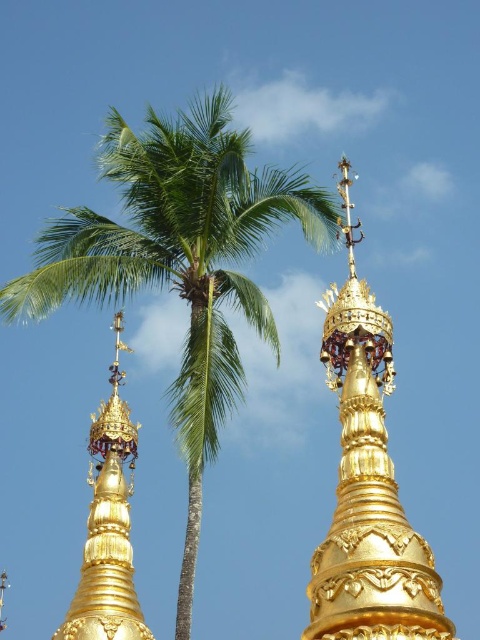
Question: Is green leafy palm tree at left smaller than gold polished stupa at upper center?

Choices:
 (A) no
 (B) yes

Answer: (A)

Question: Among these objects, which one is farthest from the camera?

Choices:
 (A) gold polished stupa at upper center
 (B) gold/gilded stupa at center
 (C) green leafy palm tree at left

Answer: (B)

Question: Which of the following is the closest to the observer?

Choices:
 (A) green leafy palm tree at left
 (B) gold polished stupa at upper center
 (C) gold/gilded stupa at center

Answer: (B)

Question: Observing the image, what is the correct spatial positioning of green leafy palm tree at left in reference to gold/gilded stupa at center?

Choices:
 (A) above
 (B) below

Answer: (A)

Question: Is gold polished stupa at upper center further to the viewer compared to gold/gilded stupa at center?

Choices:
 (A) no
 (B) yes

Answer: (A)

Question: Which of the following is the closest to the observer?

Choices:
 (A) gold polished stupa at upper center
 (B) gold/gilded stupa at center

Answer: (A)